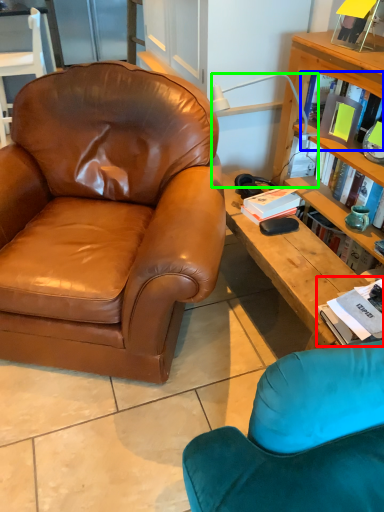
Question: Based on their relative distances, which object is nearer to book (highlighted by a red box)? Choose from book (highlighted by a blue box) and lamp (highlighted by a green box).

Choices:
 (A) book
 (B) lamp

Answer: (A)